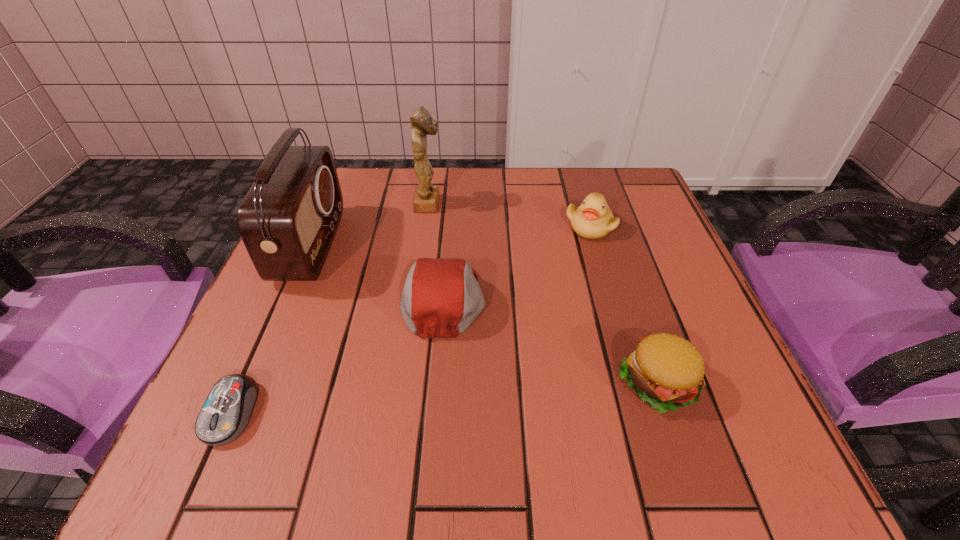
This screenshot has width=960, height=540. I want to click on free region located on the left of the hamburger, so click(x=375, y=382).

You are a GUI agent. You are given a task and a screenshot of the screen. Output one action in this format:
    pyautogui.click(x=<x>, y=<y>)
    Task: Click on the figurine at the far edge
    This screenshot has width=960, height=540.
    Given the screenshot: What is the action you would take?
    pyautogui.click(x=426, y=199)

This screenshot has height=540, width=960. I want to click on radio receiver positioned at the far edge, so click(288, 219).

At what (x,y) coordinates should I click in order to perform the action: click on duckling that is positioned at the far edge. Please return your answer as a coordinate pair (x, y). Looking at the image, I should click on (593, 219).

You are a GUI agent. You are given a task and a screenshot of the screen. Output one action in this format:
    pyautogui.click(x=<x>, y=<y>)
    Task: Click on the hamburger that is positioned at the near edge
    Image resolution: width=960 pixels, height=540 pixels.
    Given the screenshot: What is the action you would take?
    pyautogui.click(x=666, y=371)

Where is `computer mouse that is positioned at the near edge`? computer mouse that is positioned at the near edge is located at coordinates coord(226,412).

You are a GUI agent. You are given a task and a screenshot of the screen. Output one action in this format:
    pyautogui.click(x=<x>, y=<y>)
    Task: Click on the radio receiver that is at the left edge
    This screenshot has height=540, width=960.
    Given the screenshot: What is the action you would take?
    pyautogui.click(x=288, y=219)

Locate an element on the screen. computer mouse positioned at the left edge is located at coordinates (226, 412).

Where is `duckling that is at the right edge`? duckling that is at the right edge is located at coordinates (593, 219).

Locate an element on the screen. The image size is (960, 540). hamburger that is positioned at the right edge is located at coordinates (666, 371).